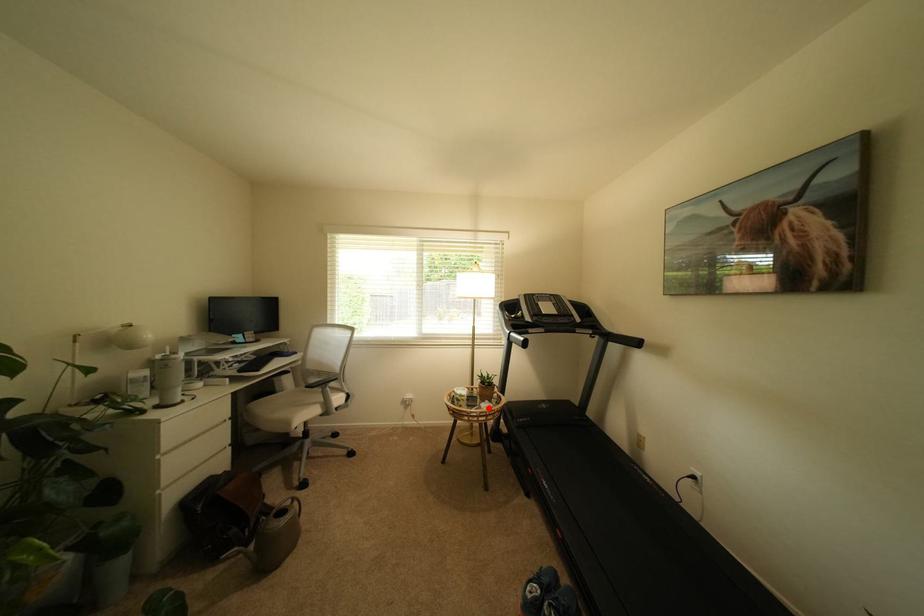
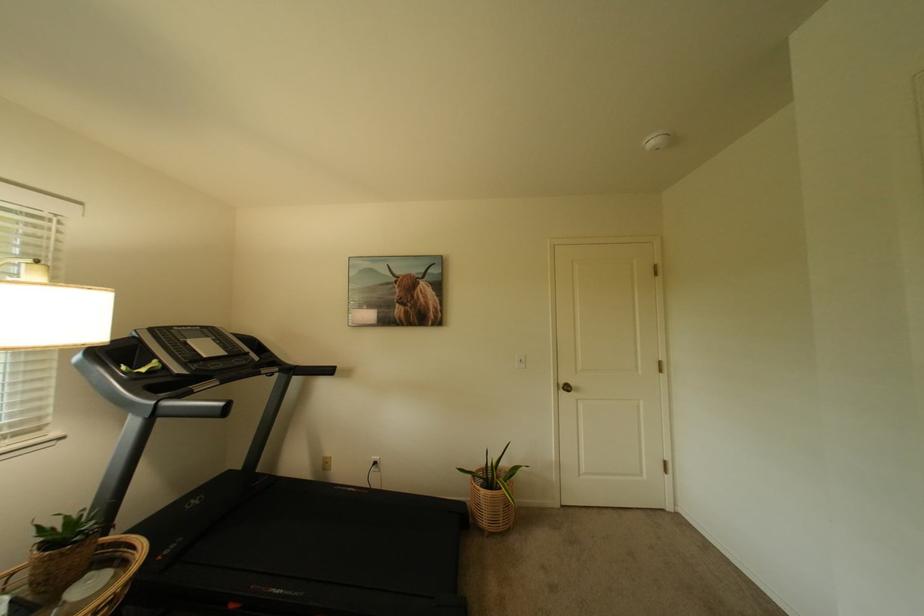
The point at the highlighted location is marked in the first image. Where is the corresponding point in the second image?

(73, 605)